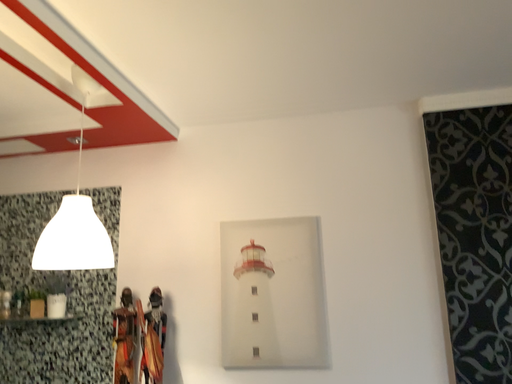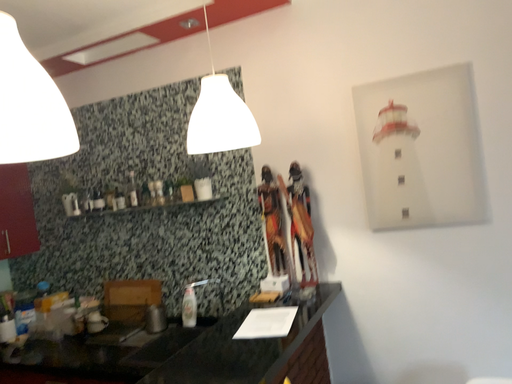
Question: Which way did the camera rotate in the video?

Choices:
 (A) rotated downward
 (B) rotated upward

Answer: (A)